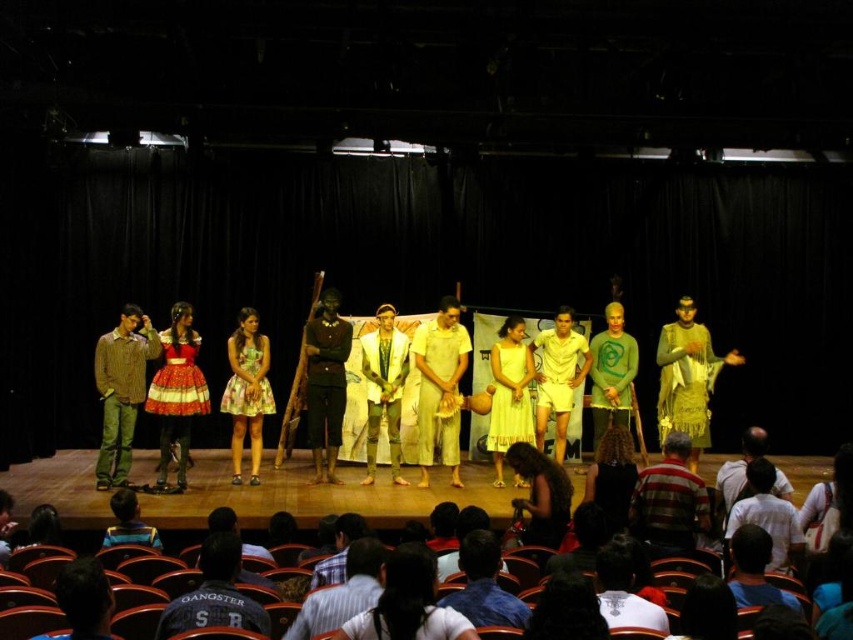
Is the position of dark blue jersey at lower left more distant than that of floral dress at center?

No, it is in front of floral dress at center.

Can you confirm if dark blue jersey at lower left is shorter than floral dress at center?

Yes.

Locate an element on the screen. dark blue jersey at lower left is located at coordinates (213, 595).

Is light yellow fabric dress at center below floral dress at center?

Actually, light yellow fabric dress at center is above floral dress at center.

Which is more to the left, light yellow fabric dress at center or floral dress at center?

From the viewer's perspective, floral dress at center appears more on the left side.

Identify the location of light yellow fabric dress at center. (439, 385).

Where is `light yellow fabric dress at center`? The height and width of the screenshot is (640, 853). light yellow fabric dress at center is located at coordinates (439, 385).

Who is positioned more to the left, green matte shirt at center or white matte shorts at center?

white matte shorts at center is more to the left.

The image size is (853, 640). What do you see at coordinates (611, 372) in the screenshot?
I see `green matte shirt at center` at bounding box center [611, 372].

What do you see at coordinates (611, 372) in the screenshot? I see `green matte shirt at center` at bounding box center [611, 372].

You are a GUI agent. You are given a task and a screenshot of the screen. Output one action in this format:
    pyautogui.click(x=<x>, y=<y>)
    Task: Click on the green matte shirt at center
    
    Given the screenshot: What is the action you would take?
    pyautogui.click(x=611, y=372)